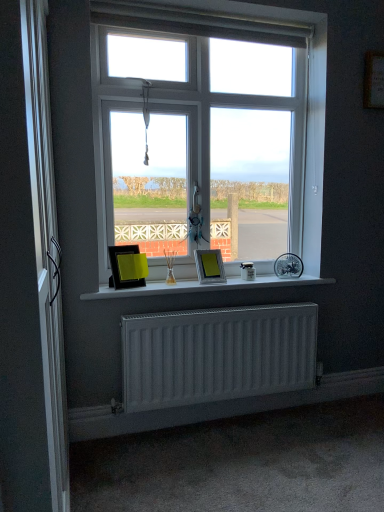
Question: From a real-world perspective, does white matte radiator at lower center sit lower than silver metallic screen door at left?

Choices:
 (A) no
 (B) yes

Answer: (B)

Question: Would you say white matte radiator at lower center contains silver metallic screen door at left?

Choices:
 (A) yes
 (B) no

Answer: (B)

Question: Considering the relative positions of white matte radiator at lower center and silver metallic screen door at left in the image provided, is white matte radiator at lower center in front of silver metallic screen door at left?

Choices:
 (A) no
 (B) yes

Answer: (A)

Question: Is white matte radiator at lower center placed right next to silver metallic screen door at left?

Choices:
 (A) yes
 (B) no

Answer: (B)

Question: Is white matte radiator at lower center positioned beyond the bounds of silver metallic screen door at left?

Choices:
 (A) yes
 (B) no

Answer: (A)

Question: Is matte black picture frame at center, marked as the second picture frame in a right-to-left arrangement, bigger or smaller than white matte radiator at lower center?

Choices:
 (A) small
 (B) big

Answer: (A)

Question: Is matte black picture frame at center, marked as the 1th picture frame in a left-to-right arrangement, wider or thinner than white matte radiator at lower center?

Choices:
 (A) thin
 (B) wide

Answer: (B)

Question: Is point (140, 286) closer or farther from the camera than point (289, 308)?

Choices:
 (A) closer
 (B) farther

Answer: (A)

Question: Considering the positions of matte black picture frame at center, marked as the second picture frame in a right-to-left arrangement, and white matte radiator at lower center in the image, is matte black picture frame at center, marked as the second picture frame in a right-to-left arrangement, taller or shorter than white matte radiator at lower center?

Choices:
 (A) tall
 (B) short

Answer: (B)

Question: Is white plastic window at center taller or shorter than white matte window sill at center?

Choices:
 (A) tall
 (B) short

Answer: (A)

Question: In terms of width, does white plastic window at center look wider or thinner when compared to white matte window sill at center?

Choices:
 (A) thin
 (B) wide

Answer: (A)

Question: In the image, is white plastic window at center positioned in front of or behind white matte window sill at center?

Choices:
 (A) front
 (B) behind

Answer: (B)

Question: From a real-world perspective, is white plastic window at center above or below white matte window sill at center?

Choices:
 (A) below
 (B) above

Answer: (B)

Question: Is silver metallic screen door at left inside the boundaries of metallic silver picture frame at center, the second picture frame viewed from the left, or outside?

Choices:
 (A) outside
 (B) inside

Answer: (A)

Question: In terms of width, does silver metallic screen door at left look wider or thinner when compared to metallic silver picture frame at center, which ranks as the 1th picture frame in right-to-left order?

Choices:
 (A) wide
 (B) thin

Answer: (B)